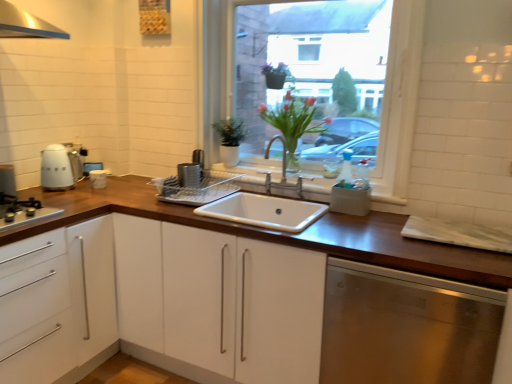
What do you see at coordinates (22, 211) in the screenshot? I see `black matte gas stove at left` at bounding box center [22, 211].

This screenshot has height=384, width=512. I want to click on clear glass window at center, so click(x=401, y=96).

The height and width of the screenshot is (384, 512). What do you see at coordinates (282, 233) in the screenshot?
I see `white matte cabinet at center, the first cabinetry in the right-to-left sequence` at bounding box center [282, 233].

This screenshot has width=512, height=384. Describe the element at coordinates (264, 212) in the screenshot. I see `white ceramic sink at center` at that location.

The height and width of the screenshot is (384, 512). In order to click on white glossy cabinet at left, the 2th cabinetry viewed from the right in this screenshot , I will do click(57, 302).

Is stainless steel dishwasher at lower right facing away from matte white kettle at left?

No, matte white kettle at left is not at the back of stainless steel dishwasher at lower right.

From the picture: Is stainless steel dishwasher at lower right situated inside matte white kettle at left or outside?

stainless steel dishwasher at lower right is outside matte white kettle at left.

Can you see stainless steel dishwasher at lower right touching matte white kettle at left?

stainless steel dishwasher at lower right and matte white kettle at left are clearly separated.

Based on the photo, which is more distant, (x=59, y=224) or (x=57, y=177)?

The point (x=57, y=177) is farther from the camera.

Looking at their sizes, would you say white matte cabinet at center, which is the second cabinetry in left-to-right order, is wider or thinner than matte white kettle at left?

Clearly, white matte cabinet at center, which is the second cabinetry in left-to-right order, has more width compared to matte white kettle at left.

In the image, is white matte cabinet at center, which is the second cabinetry in left-to-right order, positioned in front of or behind matte white kettle at left?

Clearly, white matte cabinet at center, which is the second cabinetry in left-to-right order, is in front of matte white kettle at left.

At what (x,y) coordinates should I click in order to perform the action: click on kitchen appliance above the white matte cabinet at center, which is the second cabinetry in left-to-right order (from a real-world perspective). Please return your answer as a coordinate pair (x, y). Image resolution: width=512 pixels, height=384 pixels. Looking at the image, I should click on (61, 166).

From a real-world perspective, is clear glass window at center above or below black matte gas stove at left?

In terms of real-world spatial position, clear glass window at center is above black matte gas stove at left.

From the image's perspective, is clear glass window at center located beneath black matte gas stove at left?

No, from the image's perspective, clear glass window at center is not beneath black matte gas stove at left.

The height and width of the screenshot is (384, 512). In order to click on gas stove on the left of clear glass window at center in this screenshot , I will do `click(22, 211)`.

Looking at this image, considering the positions of objects clear glass window at center and black matte gas stove at left in the image provided, who is behind, clear glass window at center or black matte gas stove at left?

clear glass window at center is more distant.

From the picture: From a real-world perspective, who is located lower, stainless steel dishwasher at lower right or clear glass window at center?

stainless steel dishwasher at lower right.

Is stainless steel dishwasher at lower right positioned beyond the bounds of clear glass window at center?

Absolutely, stainless steel dishwasher at lower right is external to clear glass window at center.

Between stainless steel dishwasher at lower right and clear glass window at center, which one is positioned behind?

clear glass window at center is further from the camera.

Who is smaller, stainless steel dishwasher at lower right or clear glass window at center?

clear glass window at center.

Can you confirm if white glossy cabinet at left, the 2th cabinetry viewed from the right, is wider than matte white kettle at left?

Yes.

Looking at this image, which point is more forward, (63, 248) or (47, 155)?

The point (63, 248) is closer to the camera.

Which is correct: white glossy cabinet at left, the 2th cabinetry viewed from the right, is inside matte white kettle at left, or outside of it?

white glossy cabinet at left, the 2th cabinetry viewed from the right, is spatially situated outside matte white kettle at left.

Which is more to the left, white glossy cabinet at left, placed as the first cabinetry when sorted from left to right, or matte white kettle at left?

Positioned to the left is white glossy cabinet at left, placed as the first cabinetry when sorted from left to right.

Looking at this image, who is taller, white matte cabinet at center, which is the second cabinetry in left-to-right order, or translucent glass vase at center?

white matte cabinet at center, which is the second cabinetry in left-to-right order.

Does white matte cabinet at center, the first cabinetry in the right-to-left sequence, come behind translucent glass vase at center?

No.

Does point (486, 251) lie behind point (308, 99)?

No.

Is translucent glass vase at center facing towards matte white kettle at left?

No, translucent glass vase at center is not oriented towards matte white kettle at left.

Is point (290, 113) in front of point (51, 148)?

Yes.

Find the location of a particular element. kitchen appliance on the left of the stainless steel dishwasher at lower right is located at coordinates (61, 166).

From the image's perspective, starting from the matte white kettle at left, which cabinetry is the 1st one below? Please provide its 2D coordinates.

[(282, 233)]

Which object lies further to the anchor point clear glass window at center, white matte cabinet at center, the first cabinetry in the right-to-left sequence, or translucent glass vase at center?

white matte cabinet at center, the first cabinetry in the right-to-left sequence, is further to clear glass window at center.

Considering their positions, is white glossy cabinet at left, placed as the first cabinetry when sorted from left to right, positioned further to stainless steel dishwasher at lower right than white ceramic sink at center?

The object further to stainless steel dishwasher at lower right is white glossy cabinet at left, placed as the first cabinetry when sorted from left to right.

Estimate the real-world distances between objects in this image. Which object is closer to white ceramic sink at center, black matte gas stove at left or white matte cabinet at center, the first cabinetry in the right-to-left sequence?

white matte cabinet at center, the first cabinetry in the right-to-left sequence, is positioned closer to the anchor white ceramic sink at center.

In the scene shown: Based on their spatial positions, is translucent glass vase at center or white matte cabinet at center, which is the second cabinetry in left-to-right order, further from stainless steel dishwasher at lower right?

translucent glass vase at center lies further to stainless steel dishwasher at lower right than the other object.

When comparing their distances from clear glass window at center, does white ceramic sink at center or stainless steel dishwasher at lower right seem further?

Among the two, stainless steel dishwasher at lower right is located further to clear glass window at center.

Which object lies nearer to the anchor point translucent glass vase at center, clear glass window at center or white matte cabinet at center, the first cabinetry in the right-to-left sequence?

Among the two, clear glass window at center is located nearer to translucent glass vase at center.

Which object lies nearer to the anchor point matte white kettle at left, white ceramic sink at center or white glossy cabinet at left, the 2th cabinetry viewed from the right?

white glossy cabinet at left, the 2th cabinetry viewed from the right, is closer to matte white kettle at left.

Looking at the image, which one is located further to clear glass window at center, white matte cabinet at center, which is the second cabinetry in left-to-right order, or stainless steel dishwasher at lower right?

stainless steel dishwasher at lower right is further to clear glass window at center.

In order to click on open located between white matte cabinet at center, which is the second cabinetry in left-to-right order, and stainless steel dishwasher at lower right in the left-right direction in this screenshot , I will do `click(264, 212)`.

Identify the location of cabinetry between matte white kettle at left and stainless steel dishwasher at lower right. This screenshot has height=384, width=512. (282, 233).

Where is `open between matte white kettle at left and stainless steel dishwasher at lower right`? The width and height of the screenshot is (512, 384). open between matte white kettle at left and stainless steel dishwasher at lower right is located at coordinates (264, 212).

Locate an element on the screen. flower between black matte gas stove at left and clear glass window at center is located at coordinates (292, 124).